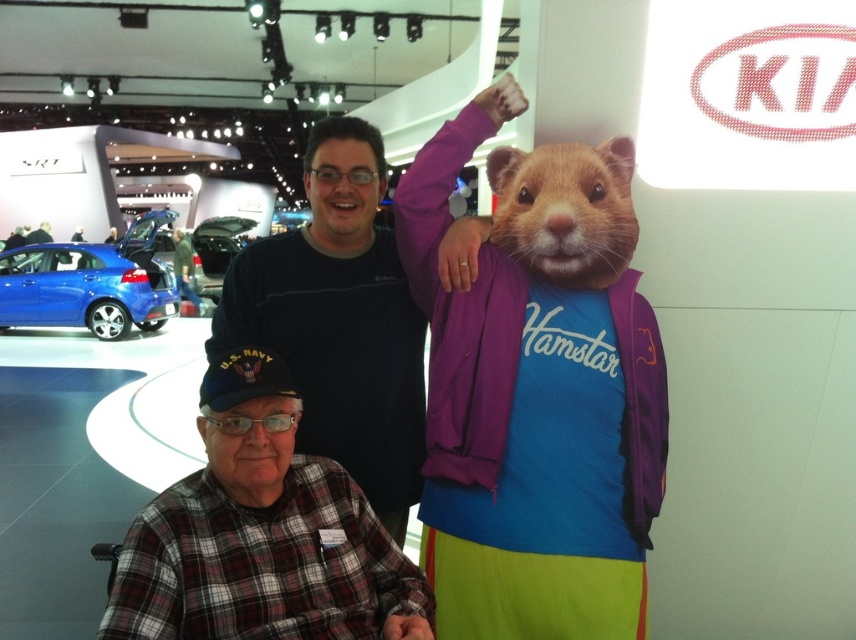
Does plaid shirt at lower left come behind shiny metallic car at center?

No, it is not.

Between point (355, 500) and point (199, 236), which one is positioned in front?

Positioned in front is point (355, 500).

Image resolution: width=856 pixels, height=640 pixels. What are the coordinates of `plaid shirt at lower left` in the screenshot? It's located at (260, 534).

Is golden fur hamster at center taller than shiny metallic car at center?

Incorrect, golden fur hamster at center's height is not larger of shiny metallic car at center's.

Who is positioned more to the right, golden fur hamster at center or shiny metallic car at center?

Positioned to the right is golden fur hamster at center.

What are the coordinates of `golden fur hamster at center` in the screenshot? It's located at (565, 209).

At what (x,y) coordinates should I click in order to perform the action: click on golden fur hamster at center. Please return your answer as a coordinate pair (x, y). The width and height of the screenshot is (856, 640). Looking at the image, I should click on (565, 209).

Is point (301, 550) positioned before point (30, 317)?

Yes, point (301, 550) is closer to viewer.

Which is behind, point (248, 442) or point (79, 268)?

Positioned behind is point (79, 268).

What do you see at coordinates (260, 534) in the screenshot?
I see `plaid shirt at lower left` at bounding box center [260, 534].

Find the location of a particular element. The image size is (856, 640). plaid shirt at lower left is located at coordinates (260, 534).